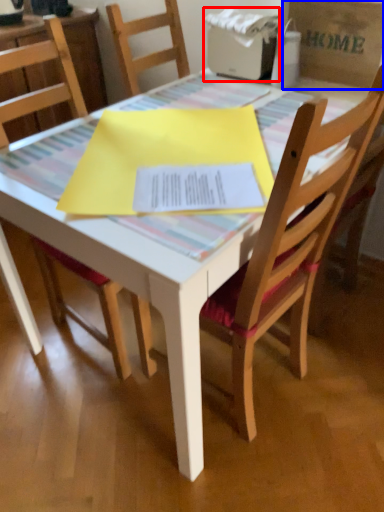
Question: Which object appears farthest to the camera in this image, printer (highlighted by a red box) or cardboard box (highlighted by a blue box)?

Choices:
 (A) printer
 (B) cardboard box

Answer: (A)